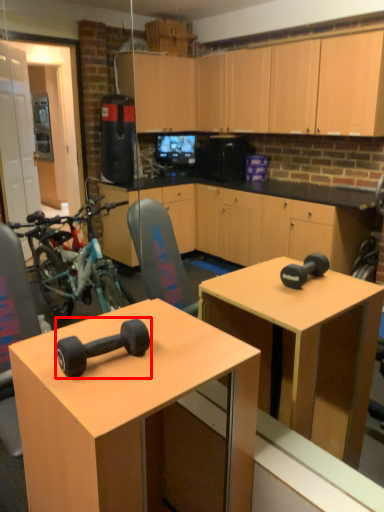
Question: Where is dumbbell (annotated by the red box) located in relation to desk in the image?

Choices:
 (A) left
 (B) right

Answer: (A)